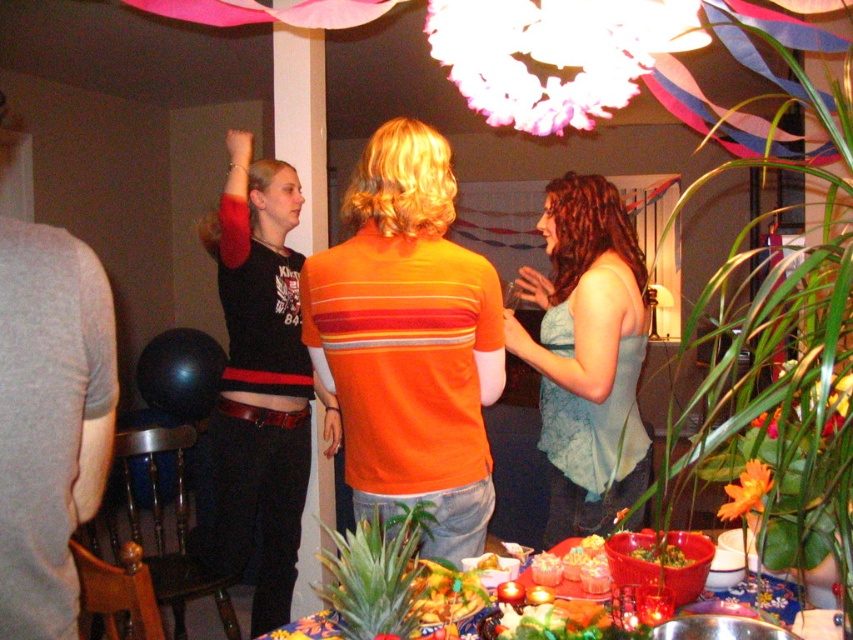
You are planning to place a new dish on the table. The dish is exactly the same size as the smooth red bowl at center. Based on the scene, can the dish fit on the smooth wooden table at center without overlapping the existing items?

The smooth wooden table at center might be wider than smooth red bowl at center, so there is a possibility that the dish can fit, but it depends on the arrangement of existing items.

You are a photographer setting up for a group photo at the party. You want to ensure both the matte black shirt at upper left and the yellow matte pineapple at center are clearly visible in the frame. Given their sizes, which object might require you to adjust your camera focus more carefully to avoid blurriness?

The yellow matte pineapple at center might require more careful focus adjustment since it is smaller in size compared to the matte black shirt at upper left, making it easier to become blurry if not properly focused on.